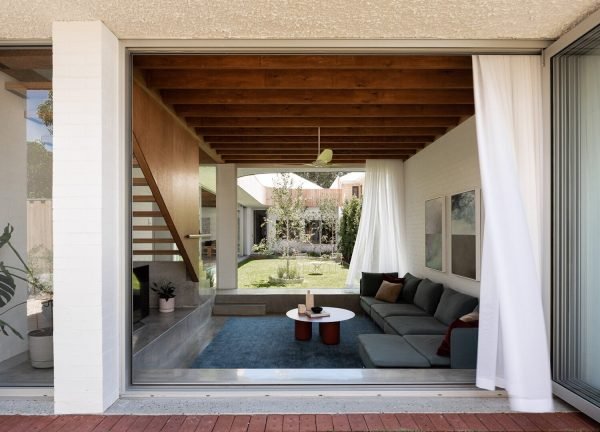
Locate an element on the screen. Image resolution: width=600 pixels, height=432 pixels. bottom part of planter to catch water overflow is located at coordinates (170, 312), (41, 365).